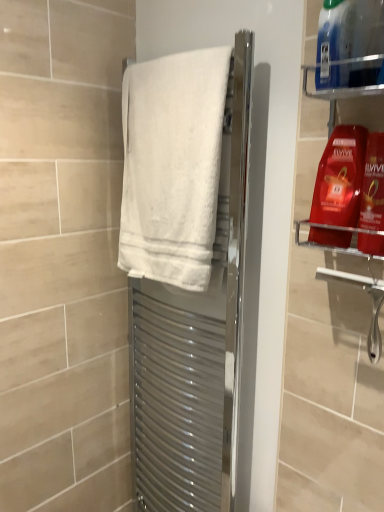
Question: Do you think white cotton towel at center is within blue plastic bottle at upper right, marked as the 3th cleaning product in a bottom-to-top arrangement, or outside of it?

Choices:
 (A) outside
 (B) inside

Answer: (A)

Question: From a real-world perspective, is white cotton towel at center above or below blue plastic bottle at upper right, marked as the first cleaning product in a top-to-bottom arrangement?

Choices:
 (A) below
 (B) above

Answer: (A)

Question: Which object is the farthest from the shiny red shampoo at upper right, which appears as the second cleaning product when ordered from the bottom?

Choices:
 (A) white fabric towel at center
 (B) shiny red plastic shampoo bottle at upper right, which is counted as the third cleaning product, starting from the top
 (C) white cotton towel at center
 (D) blue plastic bottle at upper right, marked as the 3th cleaning product in a bottom-to-top arrangement

Answer: (A)

Question: Which is nearer to the shiny red shampoo at upper right, which appears as the second cleaning product when ordered from the bottom?

Choices:
 (A) shiny red plastic shampoo bottle at upper right, which is counted as the third cleaning product, starting from the top
 (B) white cotton towel at center
 (C) blue plastic bottle at upper right, marked as the 3th cleaning product in a bottom-to-top arrangement
 (D) white fabric towel at center

Answer: (A)